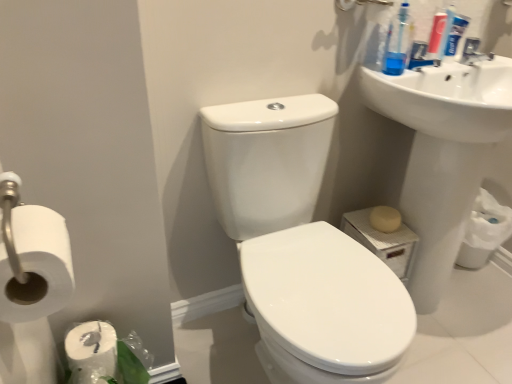
The width and height of the screenshot is (512, 384). What do you see at coordinates (443, 154) in the screenshot? I see `white glossy sink at upper right, placed as the second sink when sorted from left to right` at bounding box center [443, 154].

The width and height of the screenshot is (512, 384). What do you see at coordinates (385, 219) in the screenshot? I see `beige matte soap at lower right` at bounding box center [385, 219].

I want to click on white matte toilet paper at left, which is the 1th toilet paper in front-to-back order, so click(x=34, y=295).

What is the approximate width of white glossy sink at upper right, which is the second sink from right to left?

white glossy sink at upper right, which is the second sink from right to left, is 24.86 inches wide.

The image size is (512, 384). Describe the element at coordinates (398, 42) in the screenshot. I see `blue plastic toothbrush at upper right, positioned as the second cleaning product in right-to-left order` at that location.

Describe the element at coordinates (484, 231) in the screenshot. I see `white matte toilet paper at lower right, acting as the 1th toilet paper starting from the right` at that location.

Find the location of `white glossy sink at upper right, placed as the second sink when sorted from left to right`. white glossy sink at upper right, placed as the second sink when sorted from left to right is located at coordinates (443, 154).

Are white glossy toilet at center and white matte toilet paper at lower right, the 1th toilet paper viewed from the back, far apart?

A: That's not correct — white glossy toilet at center is a little close to white matte toilet paper at lower right, the 1th toilet paper viewed from the back.

Image resolution: width=512 pixels, height=384 pixels. In order to click on the 1st toilet paper above the white glossy toilet at center (from the image's perspective) in this screenshot , I will do `click(484, 231)`.

Is point (319, 293) closer to camera compared to point (474, 256)?

Yes, point (319, 293) is closer to viewer.

Is white glossy toilet at center oriented towards white matte toilet paper at lower right, the 1th toilet paper viewed from the back?

No, white glossy toilet at center does not turn towards white matte toilet paper at lower right, the 1th toilet paper viewed from the back.

Is white matte toilet paper at left, which ranks as the 2th toilet paper in right-to-left order, next to blue plastic toothbrush at upper right, which is counted as the 1th cleaning product, starting from the left, and touching it?

They are not placed beside each other.

From a real-world perspective, relative to blue plastic toothbrush at upper right, positioned as the second cleaning product in right-to-left order, is white matte toilet paper at left, which is the 1th toilet paper in front-to-back order, vertically above or below?

In terms of real-world spatial position, white matte toilet paper at left, which is the 1th toilet paper in front-to-back order, is below blue plastic toothbrush at upper right, positioned as the second cleaning product in right-to-left order.

Does white matte toilet paper at left, marked as the first toilet paper in a left-to-right arrangement, have a greater height compared to blue plastic toothbrush at upper right, positioned as the second cleaning product in right-to-left order?

No, white matte toilet paper at left, marked as the first toilet paper in a left-to-right arrangement, is not taller than blue plastic toothbrush at upper right, positioned as the second cleaning product in right-to-left order.

Considering the sizes of objects white matte toilet paper at left, which ranks as the 2th toilet paper in right-to-left order, and blue plastic toothbrush at upper right, which is counted as the 1th cleaning product, starting from the left, in the image provided, who is thinner, white matte toilet paper at left, which ranks as the 2th toilet paper in right-to-left order, or blue plastic toothbrush at upper right, which is counted as the 1th cleaning product, starting from the left,?

With smaller width is blue plastic toothbrush at upper right, which is counted as the 1th cleaning product, starting from the left.

From a real-world perspective, does white glossy sink at upper right, which is the second sink from right to left, stand above blue plastic toothpaste tube at upper right, acting as the first cleaning product starting from the right?

Actually, white glossy sink at upper right, which is the second sink from right to left, is physically below blue plastic toothpaste tube at upper right, acting as the first cleaning product starting from the right, in the real world.

Which of these two, white glossy sink at upper right, the first sink viewed from the left, or blue plastic toothpaste tube at upper right, acting as the first cleaning product starting from the right, stands taller?

Standing taller between the two is white glossy sink at upper right, the first sink viewed from the left.

Which is behind, point (305, 191) or point (454, 39)?

The point (454, 39) is behind.

From the image's perspective, which one is positioned lower, white glossy sink at upper right, the first sink viewed from the left, or blue plastic toothpaste tube at upper right, the second cleaning product positioned from the left?

white glossy sink at upper right, the first sink viewed from the left, appears lower in the image.

In the image, there is a beige matte soap at lower right. In order to click on toilet paper below it (from the image's perspective) in this screenshot , I will do `click(484, 231)`.

How distant is beige matte soap at lower right from white matte toilet paper at lower right, the 1th toilet paper viewed from the back?

20.18 inches.

Considering the relative positions of beige matte soap at lower right and white matte toilet paper at lower right, the 2th toilet paper viewed from the left, in the image provided, is beige matte soap at lower right to the right of white matte toilet paper at lower right, the 2th toilet paper viewed from the left, from the viewer's perspective?

No.

Who is smaller, beige matte soap at lower right or white matte toilet paper at lower right, the 1th toilet paper viewed from the back?

Smaller between the two is beige matte soap at lower right.

Is the depth of white glossy sink at upper right, the first sink viewed from the left, greater than that of blue plastic toothbrush at upper right, which is counted as the 1th cleaning product, starting from the left?

No, the depth of white glossy sink at upper right, the first sink viewed from the left, is less than that of blue plastic toothbrush at upper right, which is counted as the 1th cleaning product, starting from the left.

Is blue plastic toothbrush at upper right, positioned as the second cleaning product in right-to-left order, inside white glossy sink at upper right, which is the second sink from right to left?

That's incorrect, blue plastic toothbrush at upper right, positioned as the second cleaning product in right-to-left order, is not inside white glossy sink at upper right, which is the second sink from right to left.

Does white glossy sink at upper right, which is the second sink from right to left, have a larger size compared to blue plastic toothbrush at upper right, positioned as the second cleaning product in right-to-left order?

Correct, white glossy sink at upper right, which is the second sink from right to left, is larger in size than blue plastic toothbrush at upper right, positioned as the second cleaning product in right-to-left order.

From the image's perspective, is white glossy toilet at center above white matte toilet paper at left, which is the 1th toilet paper in front-to-back order?

No, from the image's perspective, white glossy toilet at center is not on top of white matte toilet paper at left, which is the 1th toilet paper in front-to-back order.

From a real-world perspective, is white glossy toilet at center physically located above or below white matte toilet paper at left, which is the 1th toilet paper in front-to-back order?

Clearly, from a real-world perspective, white glossy toilet at center is below white matte toilet paper at left, which is the 1th toilet paper in front-to-back order.

Which is behind, point (317, 326) or point (38, 363)?

The point (317, 326) is behind.

Does white glossy toilet at center touch white matte toilet paper at left, which is the 1th toilet paper in front-to-back order?

No, white glossy toilet at center is not beside white matte toilet paper at left, which is the 1th toilet paper in front-to-back order.

Can you tell me how much beige matte soap at lower right and white glossy sink at upper right, the first sink viewed from the left, differ in facing direction?

The angular difference between beige matte soap at lower right and white glossy sink at upper right, the first sink viewed from the left, is 3.19 degrees.

Looking at their sizes, would you say beige matte soap at lower right is wider or thinner than white glossy sink at upper right, the first sink viewed from the left?

Considering their sizes, beige matte soap at lower right looks slimmer than white glossy sink at upper right, the first sink viewed from the left.

Identify the location of sink that is the 1st one above the beige matte soap at lower right (from a real-world perspective). (301, 244).

Is white glossy sink at upper right, the first sink viewed from the left, a part of beige matte soap at lower right?

No.

From the image's perspective, count 1st toilet papers upward from the white glossy toilet at center and point to it. Please provide its 2D coordinates.

[(484, 231)]

The image size is (512, 384). In order to click on the 1st toilet paper directly beneath the blue plastic toothbrush at upper right, which is counted as the 1th cleaning product, starting from the left (from a real-world perspective) in this screenshot , I will do `click(34, 295)`.

From the image, which object appears to be farther from white matte toilet paper at lower right, which is the second toilet paper from front to back, blue plastic toothpaste tube at upper right, the second cleaning product positioned from the left, or white glossy toilet at center?

white glossy toilet at center is positioned further to the anchor white matte toilet paper at lower right, which is the second toilet paper from front to back.

Looking at this image, considering their positions, is white glossy toilet at center positioned closer to white matte toilet paper at lower right, which is the second toilet paper from front to back, than beige matte soap at lower right?

beige matte soap at lower right lies closer to white matte toilet paper at lower right, which is the second toilet paper from front to back, than the other object.

Based on their spatial positions, is beige matte soap at lower right or white glossy sink at upper right, which is the second sink from right to left, further from blue plastic toothbrush at upper right, positioned as the second cleaning product in right-to-left order?

white glossy sink at upper right, which is the second sink from right to left.

Looking at the image, which one is located closer to blue plastic toothbrush at upper right, positioned as the second cleaning product in right-to-left order, white glossy toilet at center or white matte toilet paper at lower right, which is the second toilet paper from front to back?

white glossy toilet at center.

Considering their positions, is white matte toilet paper at lower right, the 1th toilet paper viewed from the back, positioned closer to blue plastic toothpaste tube at upper right, the second cleaning product positioned from the left, than white glossy toilet at center?

white matte toilet paper at lower right, the 1th toilet paper viewed from the back, is positioned closer to the anchor blue plastic toothpaste tube at upper right, the second cleaning product positioned from the left.

Based on their spatial positions, is white matte toilet paper at left, arranged as the 2th toilet paper when viewed from the back, or beige matte soap at lower right closer to white glossy sink at upper right, placed as the second sink when sorted from left to right?

Based on the image, beige matte soap at lower right appears to be nearer to white glossy sink at upper right, placed as the second sink when sorted from left to right.

Considering their positions, is white glossy toilet at center positioned further to blue plastic toothpaste tube at upper right, acting as the first cleaning product starting from the right, than beige matte soap at lower right?

white glossy toilet at center is positioned further to the anchor blue plastic toothpaste tube at upper right, acting as the first cleaning product starting from the right.

Based on their spatial positions, is white matte toilet paper at lower right, acting as the 1th toilet paper starting from the right, or white glossy toilet at center further from blue plastic toothbrush at upper right, which is counted as the 1th cleaning product, starting from the left?

white matte toilet paper at lower right, acting as the 1th toilet paper starting from the right, lies further to blue plastic toothbrush at upper right, which is counted as the 1th cleaning product, starting from the left, than the other object.

The height and width of the screenshot is (384, 512). Find the location of `cleaning product between blue plastic toothpaste tube at upper right, acting as the first cleaning product starting from the right, and white glossy toilet at center from top to bottom`. cleaning product between blue plastic toothpaste tube at upper right, acting as the first cleaning product starting from the right, and white glossy toilet at center from top to bottom is located at coordinates (398, 42).

Locate an element on the screen. The height and width of the screenshot is (384, 512). cleaning product between blue plastic toothpaste tube at upper right, acting as the first cleaning product starting from the right, and white glossy sink at upper right, placed as the second sink when sorted from left to right, from top to bottom is located at coordinates (398, 42).

Identify the location of cleaning product situated between white matte toilet paper at left, arranged as the 2th toilet paper when viewed from the back, and blue plastic toothpaste tube at upper right, acting as the first cleaning product starting from the right, from left to right. (398, 42).

Locate an element on the screen. Image resolution: width=512 pixels, height=384 pixels. sink between white glossy sink at upper right, which appears as the 1th sink when viewed from the right, and white glossy toilet at center from top to bottom is located at coordinates (301, 244).